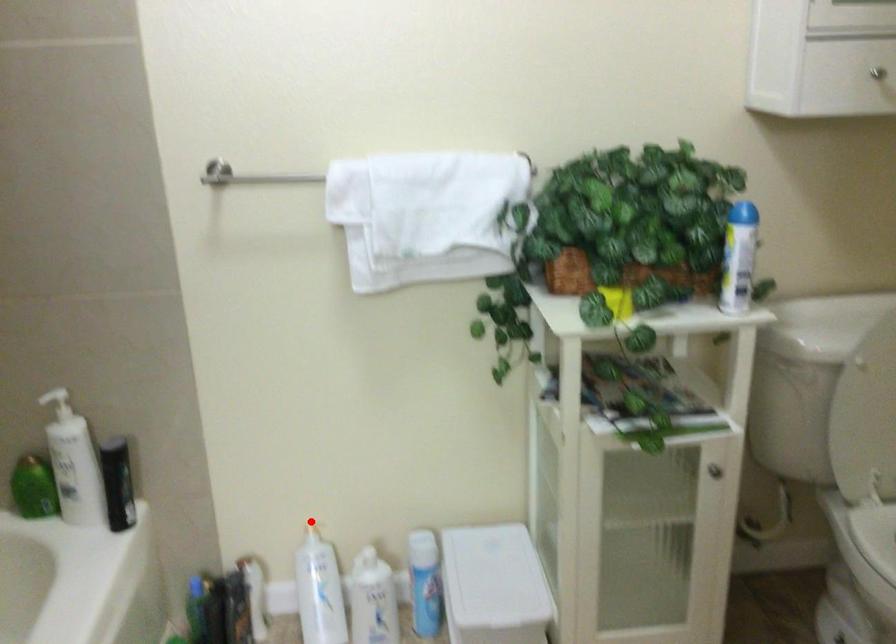
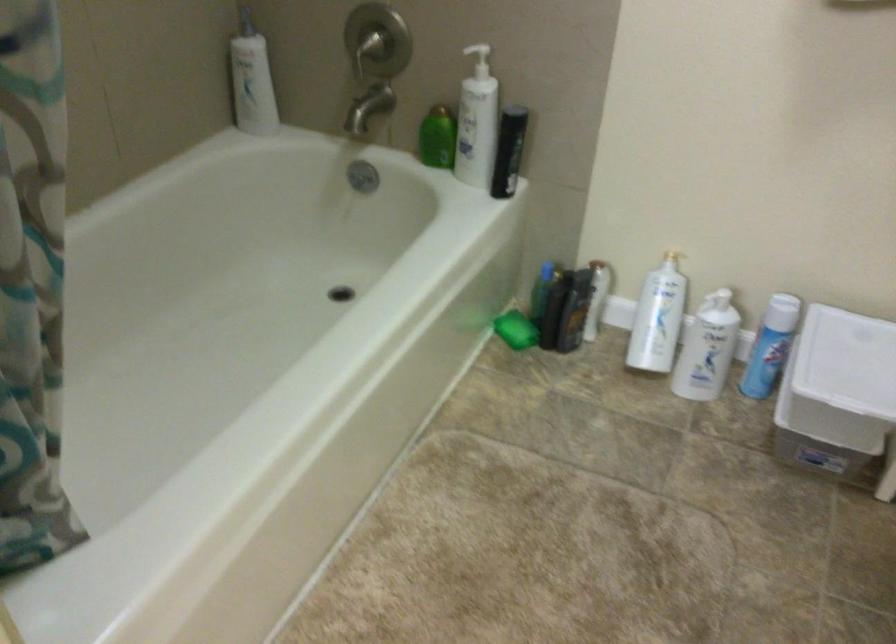
In the second image, find the point that corresponds to the highlighted location in the first image.

(672, 249)